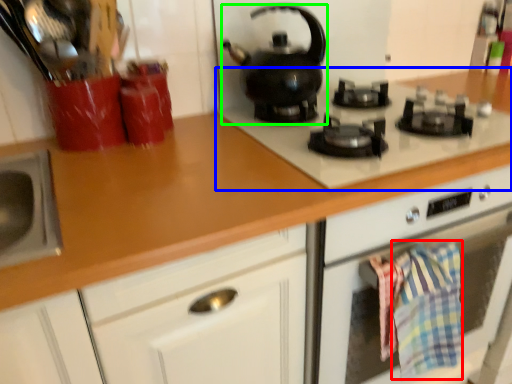
Question: Which object is the closest to the blanket (highlighted by a red box)? Choose among these: gas stove (highlighted by a blue box) or kitchen appliance (highlighted by a green box).

Choices:
 (A) gas stove
 (B) kitchen appliance

Answer: (A)